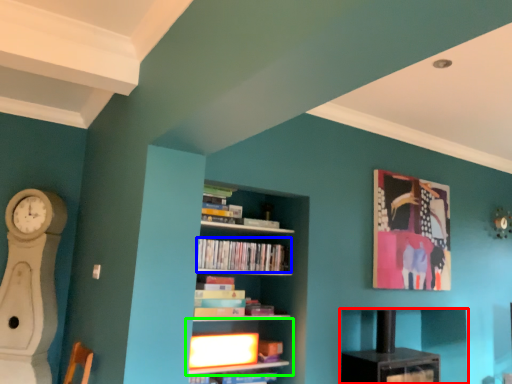
Question: Estimate the real-world distances between objects in this image. Which object is farther from shelf (highlighted by a red box), book (highlighted by a blue box) or shelf (highlighted by a green box)?

Choices:
 (A) book
 (B) shelf

Answer: (A)